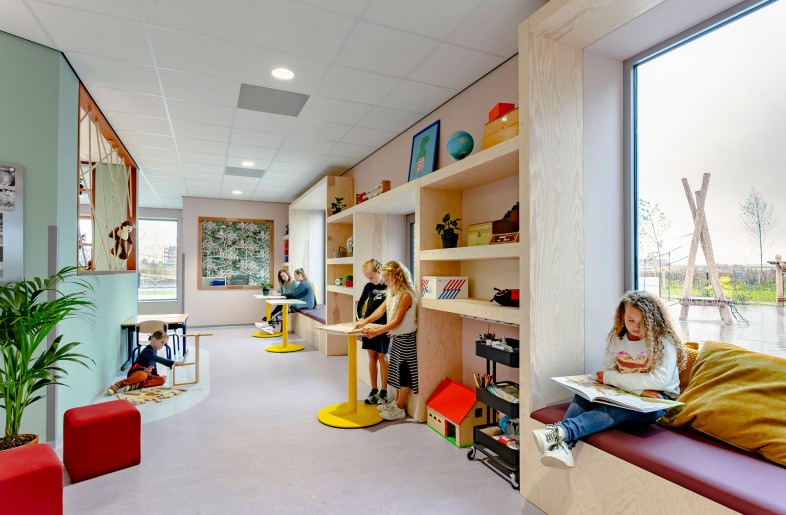
This screenshot has width=786, height=515. I want to click on wall, so click(90, 313).